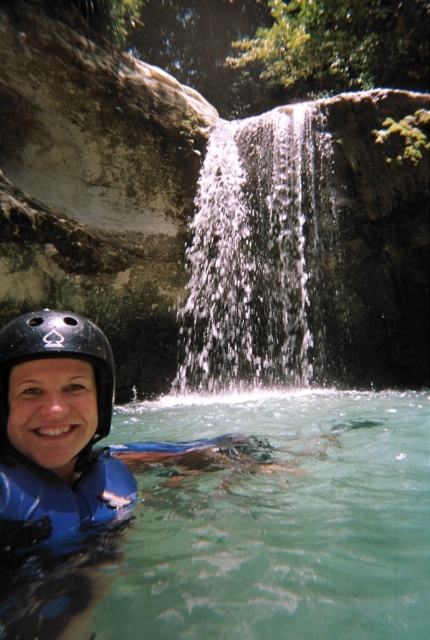
You are a photographer planning to capture the scene from above. You have to decide whether the black matte helmet at lower left is above or below the clear blue water at lower center. Based on the scene, what is your conclusion?

The clear blue water at lower center is positioned under the black matte helmet at lower left, meaning the black matte helmet at lower left is above the clear blue water at lower center.

You are a photographer positioned at the edge of the water. You want to capture a photo of the black matte helmet at lower left and the clear blue water at lower center. Which object will appear closer to the camera in the photo?

The clear blue water at lower center will appear closer to the camera in the photo because it is further to the viewer than the black matte helmet at lower left.